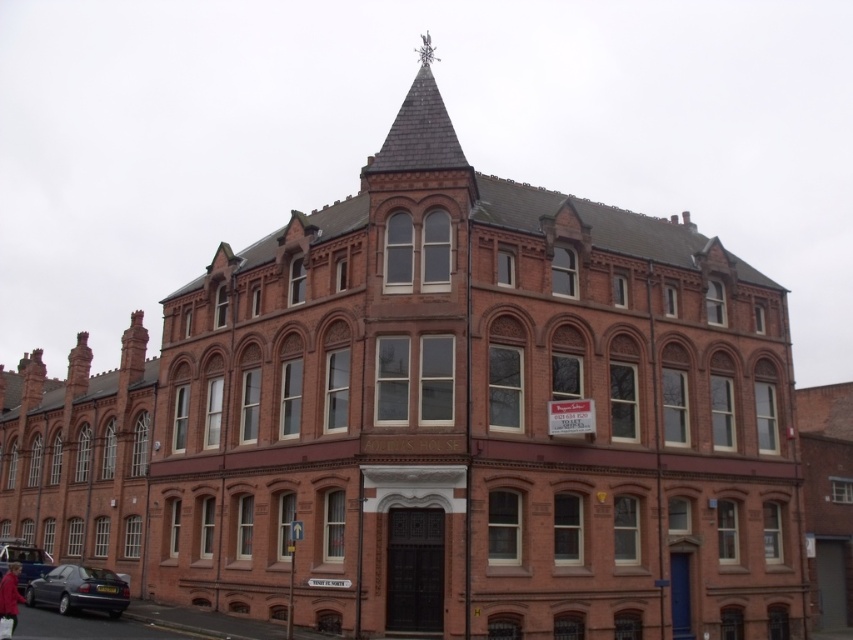
Question: Is shiny slate spire at upper center below metallic blue sedan at lower left?

Choices:
 (A) yes
 (B) no

Answer: (B)

Question: Does metallic blue sedan at lower left appear on the left side of red fabric coat at lower left?

Choices:
 (A) yes
 (B) no

Answer: (B)

Question: Is shiny slate spire at upper center bigger than red fabric coat at lower left?

Choices:
 (A) no
 (B) yes

Answer: (A)

Question: Considering the real-world distances, which object is closest to the matte black car at lower left?

Choices:
 (A) red fabric coat at lower left
 (B) metallic blue sedan at lower left
 (C) shiny slate spire at upper center

Answer: (A)

Question: Which point is closer to the camera?

Choices:
 (A) (424, 97)
 (B) (18, 577)
 (C) (16, 588)

Answer: (C)

Question: Which point is farther from the camera taking this photo?

Choices:
 (A) (13, 566)
 (B) (24, 547)
 (C) (422, 120)
 (D) (117, 589)

Answer: (B)